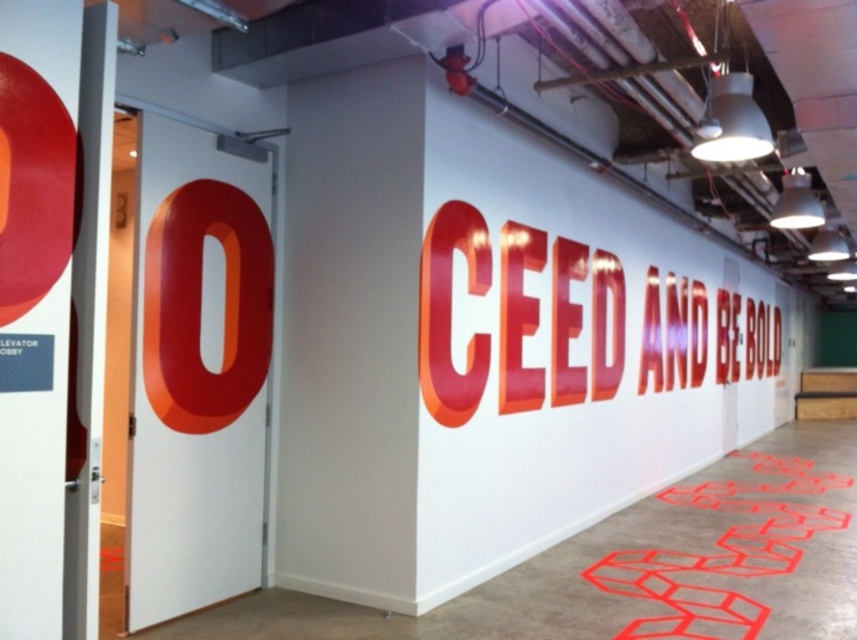
Question: Which point is farther to the camera?

Choices:
 (A) (742, 554)
 (B) (508, 250)

Answer: (A)

Question: From the image, what is the correct spatial relationship of shiny metallic letters at center in relation to red glossy hexagons at lower right?

Choices:
 (A) left
 (B) right

Answer: (B)

Question: Is shiny metallic letters at center to the right of red glossy hexagons at lower right from the viewer's perspective?

Choices:
 (A) yes
 (B) no

Answer: (A)

Question: Observing the image, what is the correct spatial positioning of shiny metallic letters at center in reference to red glossy hexagons at lower right?

Choices:
 (A) above
 (B) below

Answer: (A)

Question: Which point is closer to the camera?

Choices:
 (A) red glossy hexagons at lower right
 (B) shiny metallic letters at center

Answer: (B)